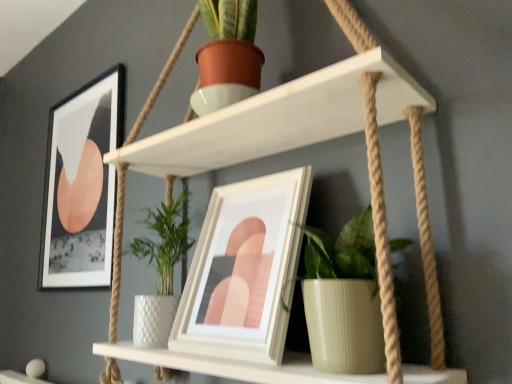
Question: In the image, is green ribbed pot at center positioned in front of or behind white glossy picture frame at center, which is the first picture frame in right-to-left order?

Choices:
 (A) front
 (B) behind

Answer: (A)

Question: Does point (315, 359) appear closer or farther from the camera than point (262, 246)?

Choices:
 (A) closer
 (B) farther

Answer: (A)

Question: Based on their relative distances, which object is farther from the green ribbed pot at center?

Choices:
 (A) white matte shelf at upper center
 (B) matte black picture frame at upper left, which appears as the 1th picture frame when viewed from the back
 (C) white glossy picture frame at center, marked as the 1th picture frame in a front-to-back arrangement

Answer: (B)

Question: Estimate the real-world distances between objects in this image. Which object is closer to the white matte shelf at upper center?

Choices:
 (A) green ribbed pot at center
 (B) matte black picture frame at upper left, which appears as the 1th picture frame when viewed from the back
 (C) white glossy picture frame at center, which appears as the 2th picture frame when viewed from the left

Answer: (C)